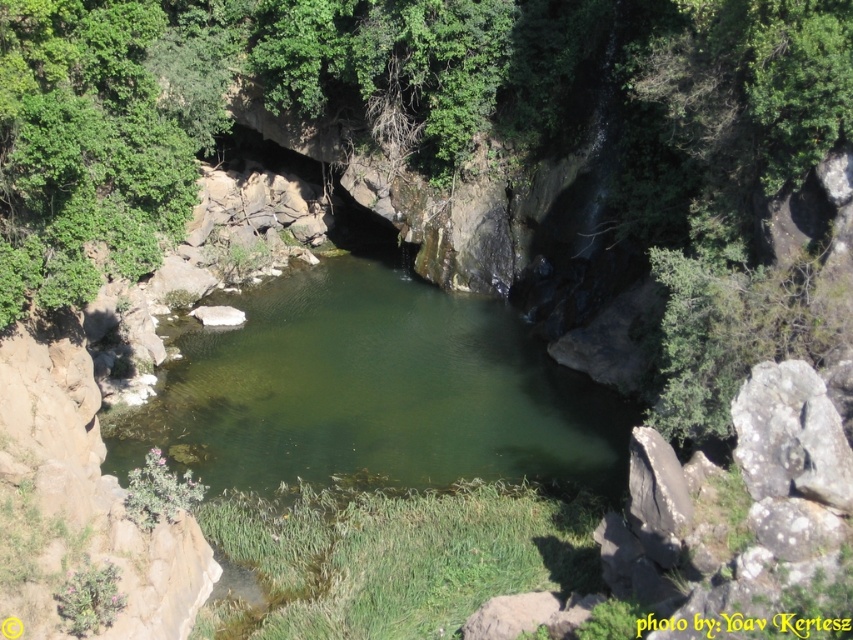
You are a hiker who wants to cross from the left side of the pool to the right side. You see the gray rough rock at right and the gray rough rock at lower right. Which rock can you step on first to start your crossing?

You can step on the gray rough rock at lower right first because it is positioned below the gray rough rock at right, making it closer to the starting point on the left side.

You are standing in the serene natural scene and want to place a small decorative stone between the two points, point (337, 305) and point (650, 467). To ensure it is visible from your current viewpoint, should you place it closer to which point?

You should place the stone closer to point (337, 305) because it is closer to your viewpoint, making objects placed near it more visible from where you are standing.